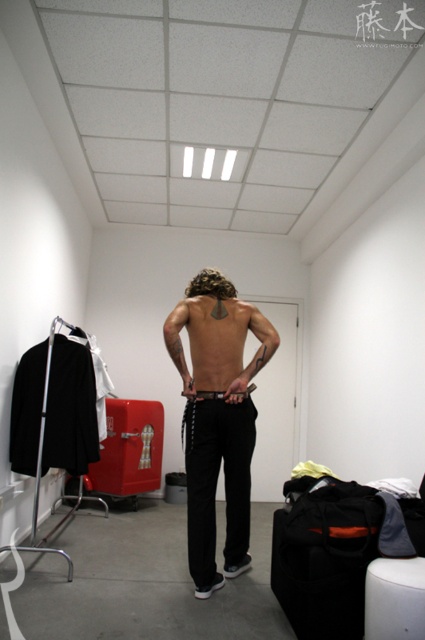
You are a person in the dressing room holding a white garment from the clothing rack on the left. You want to sit down to try it on. Is the white plastic stool at lower right within easy reach from where you are standing?

The distance between you and the white plastic stool at lower right is 5.91 feet, which is within a comfortable reach to sit down and try on the garment.

You are trying to find the black leather belt at center in the dressing room. You see the black matte pants at center. Which direction should you move relative to the pants to locate the belt?

The black leather belt at center is to the right of the black matte pants at center, so you should move to the right of the black matte pants at center to locate the belt.

You are a person trying to decide where to place your white plastic stool at lower right in the dressing room. The black matte pants at center are already occupying space. Considering their sizes, which object is taller and would require more vertical space?

The black matte pants at center has a greater height compared to the white plastic stool at lower right, so the black matte pants at center requires more vertical space.